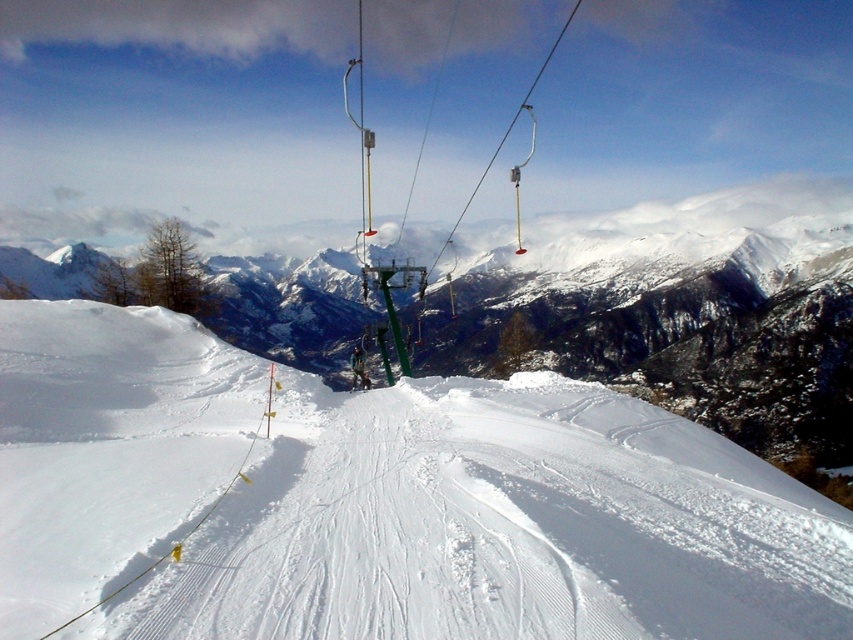
You are a skier who just arrived at the ski resort. You see the white snow at center and the matte black ski at center. Which object is positioned to the right side of the other?

The white snow at center is to the right of the matte black ski at center.

You are a photographer planning to take a picture of the white snow at center. The camera you are using has a focus point at coordinate point (378, 500). Will this focus point help you capture the white snow at center clearly?

Yes, the focus point at coordinate point (378, 500) is exactly where the white snow at center is located, so it will help capture it clearly.

You are a ski instructor planning a lesson. You want to set up a starting point on the white snow at center and a finish line at the green metallic ski lift at center. If the slope is steep enough, what is the minimum safe distance between the starting point and the finish line to ensure skiers can safely stop if needed?

The distance between the white snow at center and the green metallic ski lift at center is 61.63 meters. To ensure safety, the starting point should be placed at least 61.63 meters away from the finish line so skiers have enough space to control their speed and stop safely.